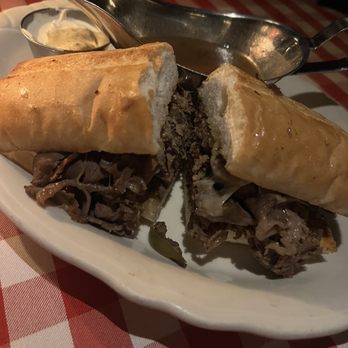
Locate an element on the screen. gravy boat is located at coordinates (286, 59).